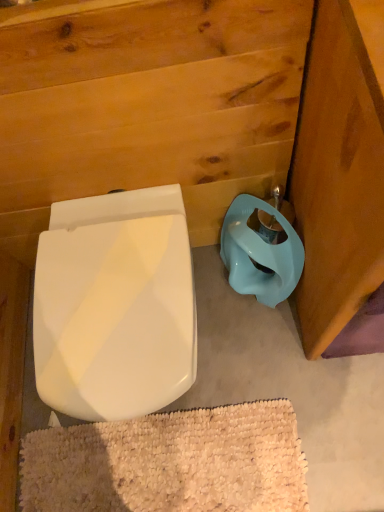
Question: Is matte blue plastic toilet bowl at lower right to the left or to the right of white glossy toilet seat at lower left in the image?

Choices:
 (A) left
 (B) right

Answer: (B)

Question: Considering the positions of matte blue plastic toilet bowl at lower right and white glossy toilet seat at lower left in the image, is matte blue plastic toilet bowl at lower right taller or shorter than white glossy toilet seat at lower left?

Choices:
 (A) short
 (B) tall

Answer: (A)

Question: Which object is positioned closest to the white glossy toilet seat at lower left?

Choices:
 (A) white textured bath mat at lower center
 (B) matte blue plastic toilet bowl at lower right

Answer: (B)

Question: Estimate the real-world distances between objects in this image. Which object is closer to the white textured bath mat at lower center?

Choices:
 (A) white glossy toilet seat at lower left
 (B) matte blue plastic toilet bowl at lower right

Answer: (A)